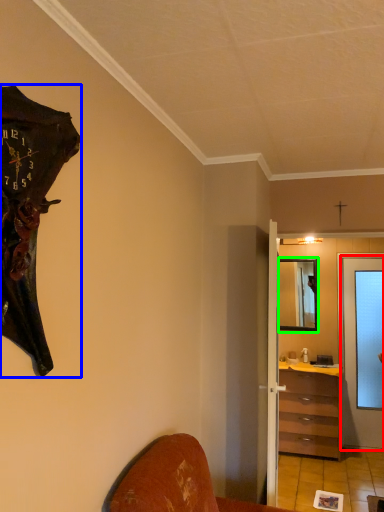
Question: Which object is positioned closest to door (highlighted by a red box)? Select from wall clock (highlighted by a blue box) and mirror (highlighted by a green box).

Choices:
 (A) wall clock
 (B) mirror

Answer: (B)